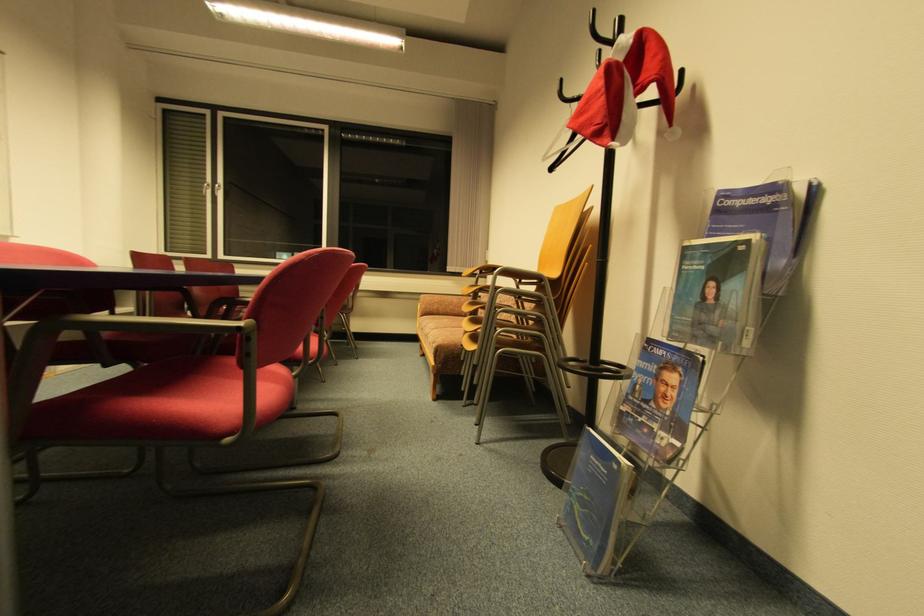
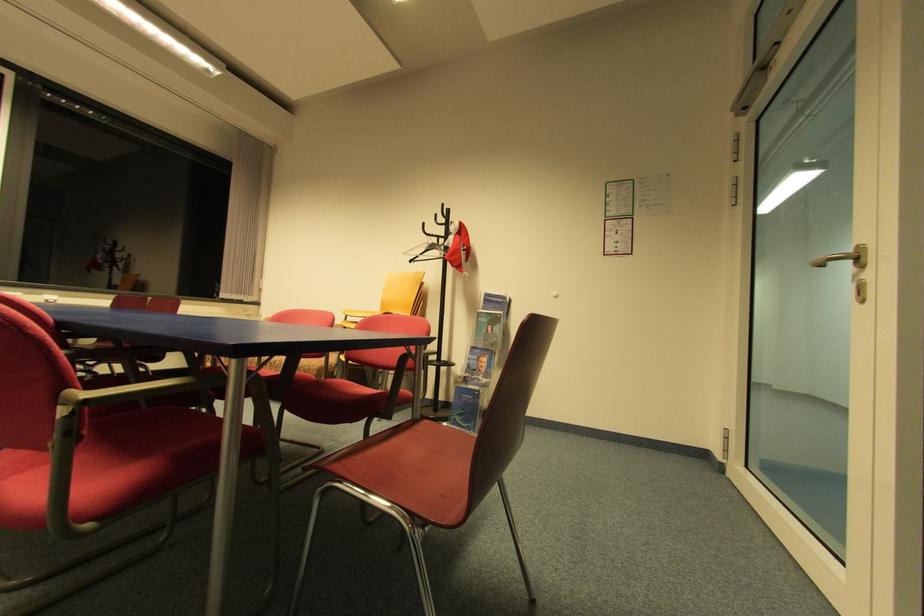
In the second image, find the point that corresponds to (x=591, y=543) in the first image.

(472, 427)